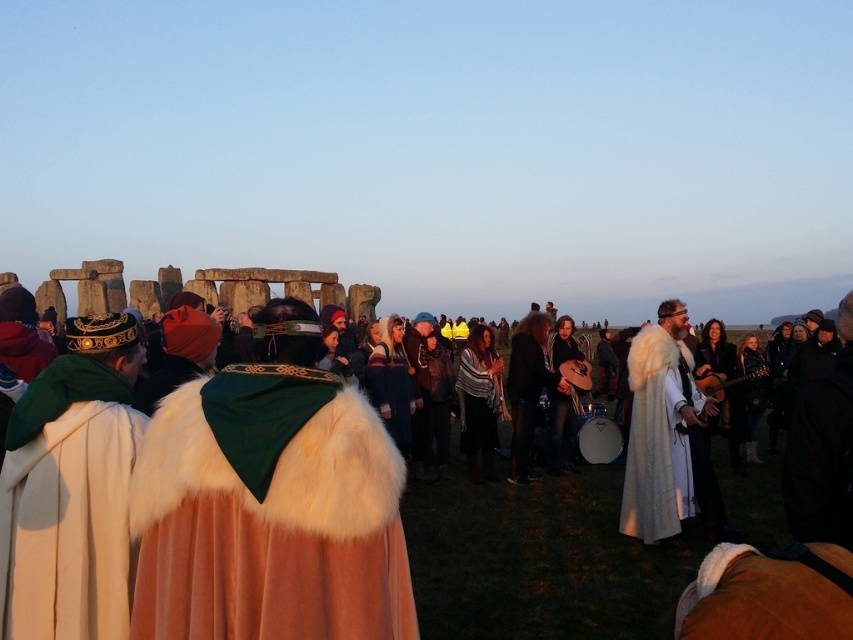
Question: Among these points, which one is farthest from the camera?

Choices:
 (A) (628, 368)
 (B) (286, 378)

Answer: (A)

Question: Where is white fur cape at center located in relation to white fur cape at left in the image?

Choices:
 (A) below
 (B) above

Answer: (B)

Question: Estimate the real-world distances between objects in this image. Which object is farther from the white fur cape at left?

Choices:
 (A) white fur cape at center
 (B) white fur cloak at center
 (C) white fur coat at right

Answer: (C)

Question: Does white fur cloak at center appear over white fur cape at left?

Choices:
 (A) yes
 (B) no

Answer: (A)

Question: Which object is the farthest from the white fur cape at left?

Choices:
 (A) white fur coat at right
 (B) white fur cloak at center
 (C) white fur cape at center

Answer: (A)

Question: Does white fur cape at center appear under white fur cloak at center?

Choices:
 (A) yes
 (B) no

Answer: (B)